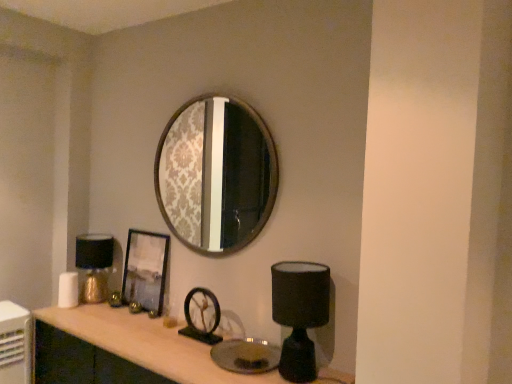
Locate an element on the screen. free space above matte wood computer desk at center (from a real-world perspective) is located at coordinates (164, 332).